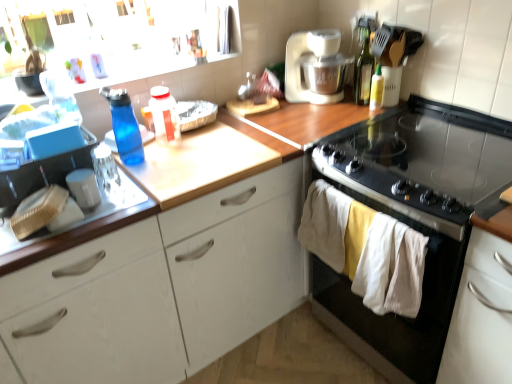
Find the location of a particular element. Image resolution: width=512 pixels, height=384 pixels. empty space that is ontop of white wood cabinet at center, which is the second cabinetry from right to left is located at coordinates [207, 142].